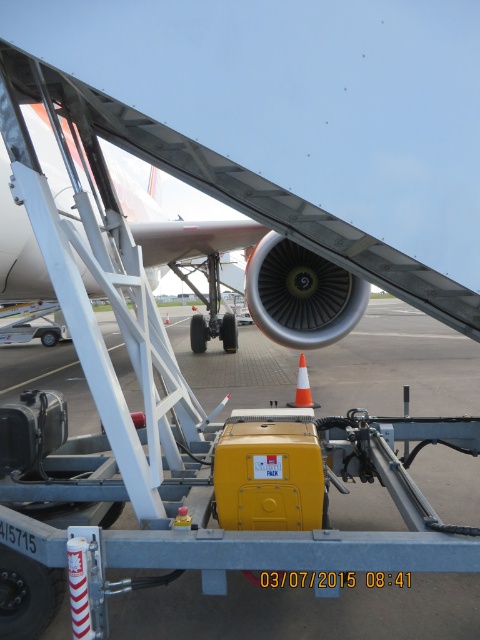
Is point (3, 65) positioned before point (307, 396)?

That is True.

Between point (304, 211) and point (301, 390), which one is positioned in front?

Positioned in front is point (304, 211).

At what (x,y) coordinates should I click in order to perform the action: click on metallic silver airplane at center. Please return your answer as a coordinate pair (x, y). The width and height of the screenshot is (480, 640). Looking at the image, I should click on (267, 202).

The width and height of the screenshot is (480, 640). I want to click on metallic silver airplane at center, so click(267, 202).

How distant is metallic silver airplane at center from orange cone at center?

They are 84.68 feet apart.

Who is more forward, (143,134) or (166,317)?

Point (143,134) is more forward.

Locate an element on the screen. metallic silver airplane at center is located at coordinates (267, 202).

Between point (310, 401) and point (165, 316), which one is positioned in front?

Point (310, 401) is in front.

Is orange matte traffic cone at center below orange cone at center?

Yes.

Where is `orange matte traffic cone at center`? orange matte traffic cone at center is located at coordinates (302, 387).